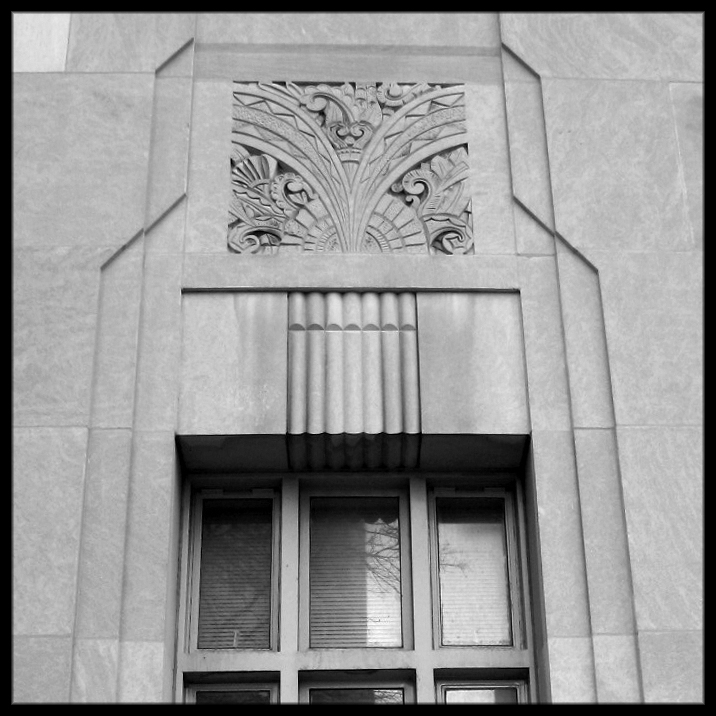
Where is `glass`? The width and height of the screenshot is (716, 716). glass is located at coordinates (464, 536).